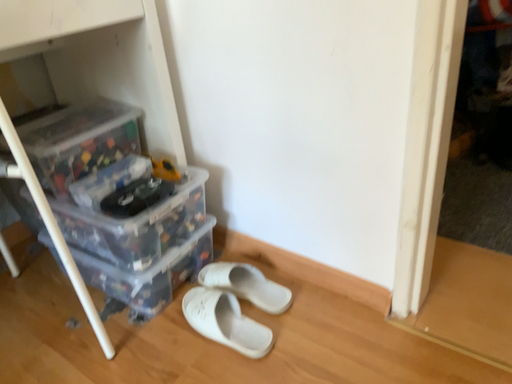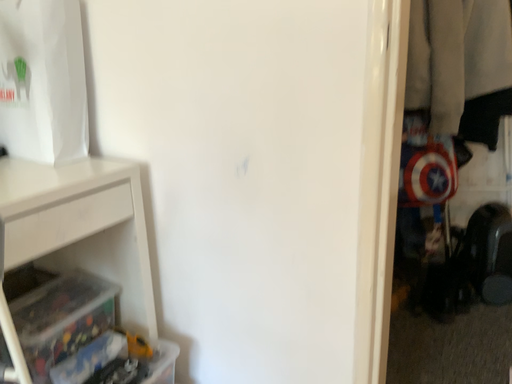
Question: Which way did the camera rotate in the video?

Choices:
 (A) rotated right
 (B) rotated left

Answer: (A)